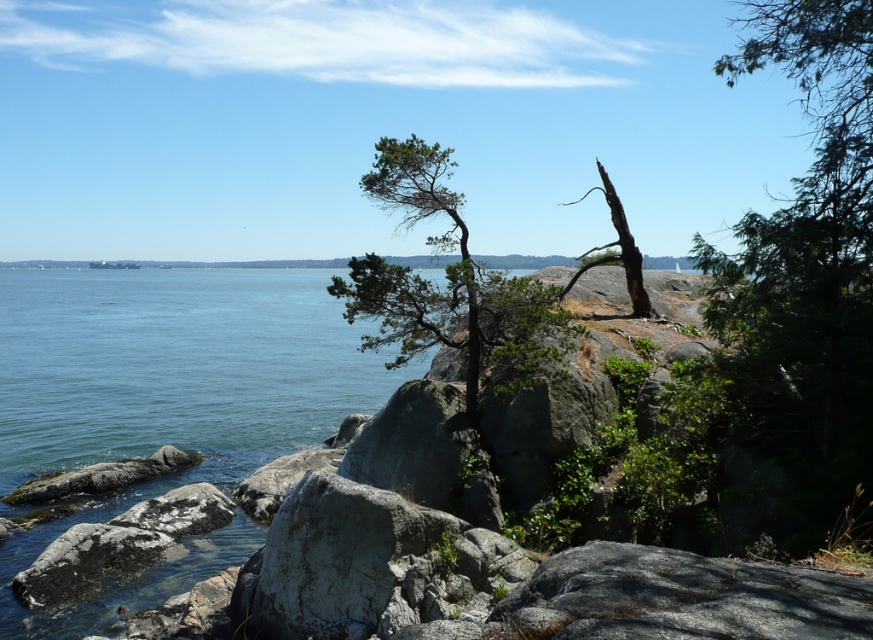
You are standing at the point labeled point (447, 284) in the coastal landscape. What object is directly beneath your feet?

The point labeled point (447, 284) corresponds to the green textured tree at center, so the green textured tree at center is directly beneath your feet.

You are a bird looking for a nesting spot. You see the green textured tree at center and the bare wood tree at center. Which tree is positioned higher up in the image for easier access from the sky?

The bare wood tree at center is positioned higher up in the image than the green textured tree at center, making it easier for the bird to access from the sky.